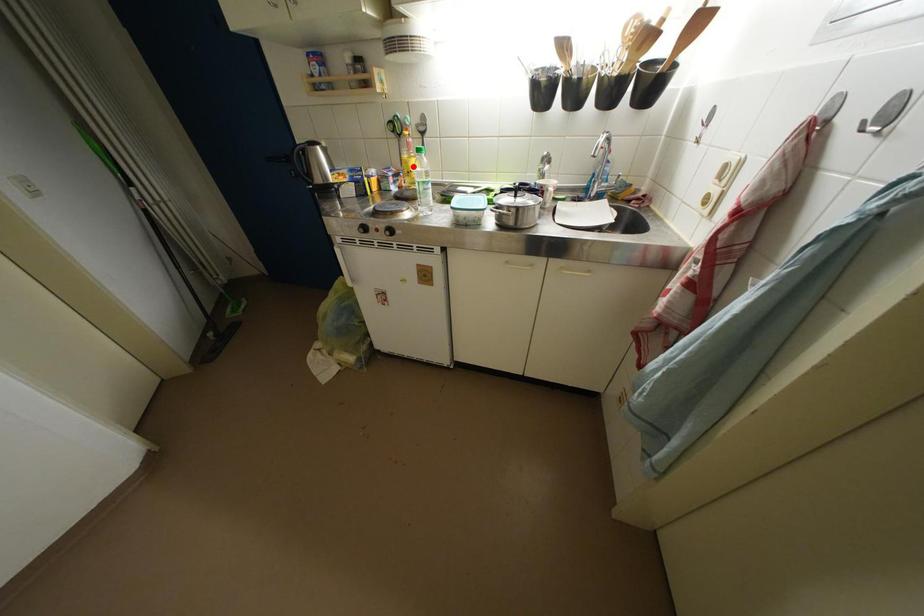
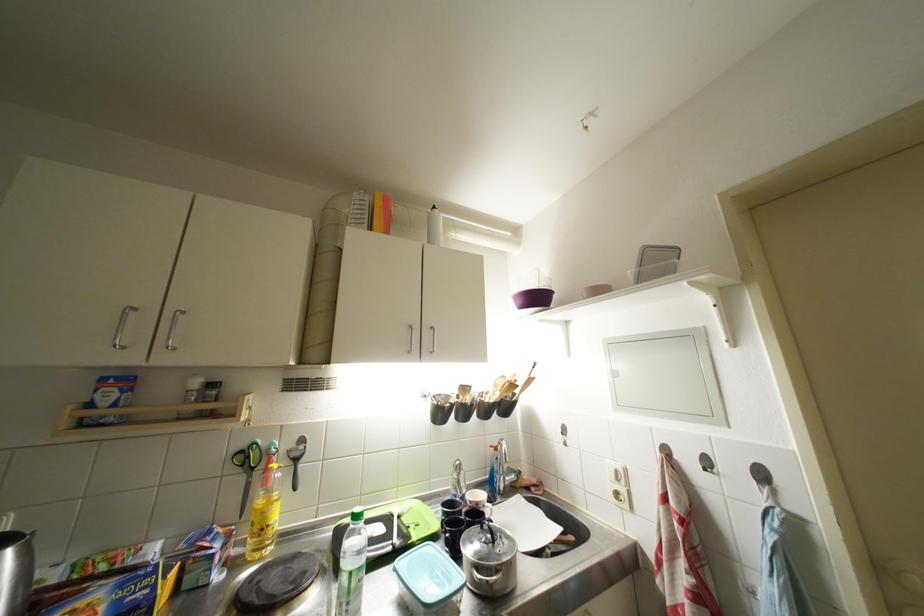
In the second image, find the point that corresponds to the highlighted location in the first image.

(271, 517)